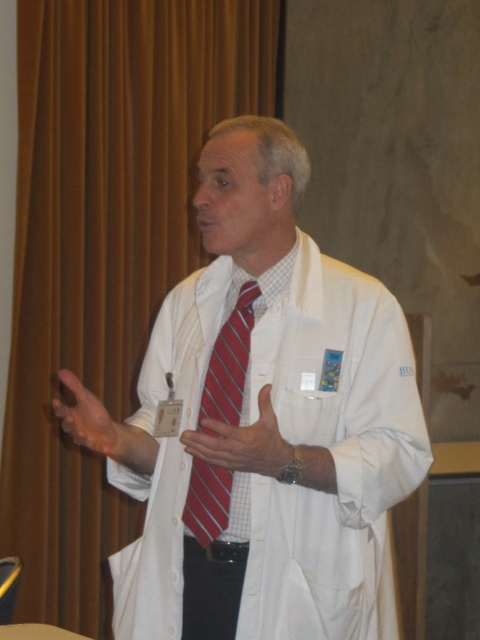
You are an attendee at a conference and notice the speaker wearing a white smooth lab coat at center and a matte red tie at center. Which item is positioned higher on the speaker?

The white smooth lab coat at center is much taller than the matte red tie at center, so the lab coat is positioned higher on the speaker.

You are an attendee at a conference and notice the speaker wearing a white smooth lab coat at center and a matte red tie at center. From your perspective, which item is closer to you?

The white smooth lab coat at center is closer to you because the matte red tie at center is behind it.